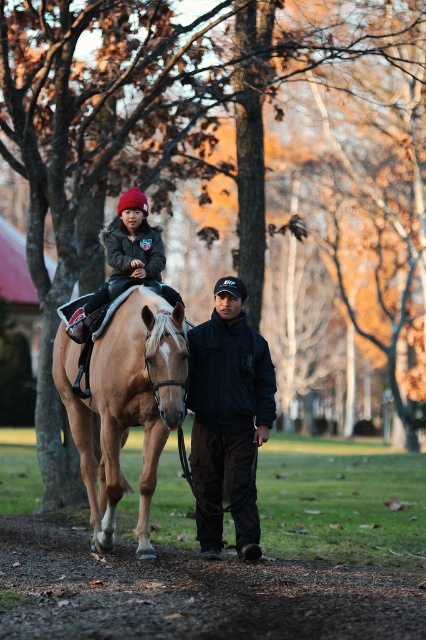
You are a photographer standing at the center of the scene. You want to take a photo of the dark gray fleece jacket at upper left without the black matte jacket at center blocking the view. Is it possible?

The dark gray fleece jacket at upper left is behind the black matte jacket at center, so it will be blocked by the black matte jacket at center. You cannot take a photo of the dark gray fleece jacket at upper left without the black matte jacket at center blocking the view.

You are a photographer trying to capture a photo of the light brown leather horse at center and the dark gray fleece jacket at upper left. Since you want both subjects to appear in the same frame, would the horse take up more space than the jacket in your photo?

The light brown leather horse at center has a larger size compared to dark gray fleece jacket at upper left, so yes, the horse would take up more space than the jacket in the photo.